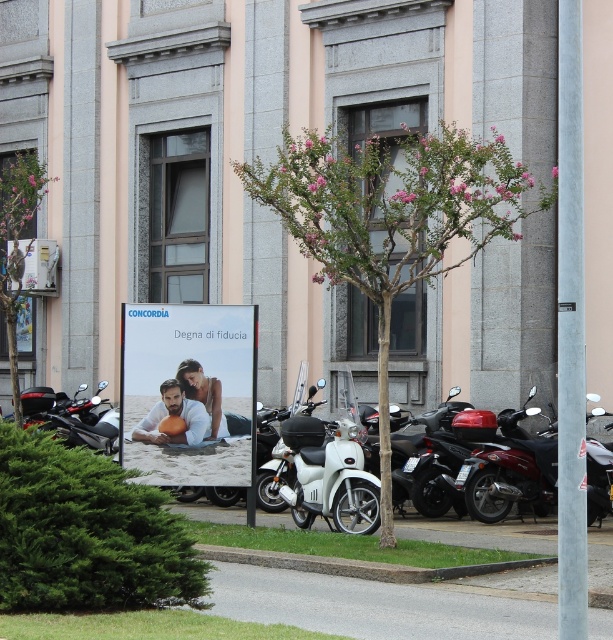
You are standing at the sidewalk in front of the building. You want to take a photo of the green leafy tree at left without any obstructions. Are you currently close enough to take a clear photo of the entire tree without moving closer?

The green leafy tree at left is 52.73 feet away from the viewer. Since this distance may be too far to capture the entire tree in a clear photo without moving closer, you should consider moving closer to ensure the tree is fully visible and in focus.

You are a delivery person who needs to park your matte black scooter at left near the green leafy tree at left without blocking the sidewalk. Based on the scene, can the scooter fit between the tree and the building?

The green leafy tree at left might be wider than the matte black scooter at left, so there may not be enough space for the scooter to fit without blocking the sidewalk. Check the width before parking.